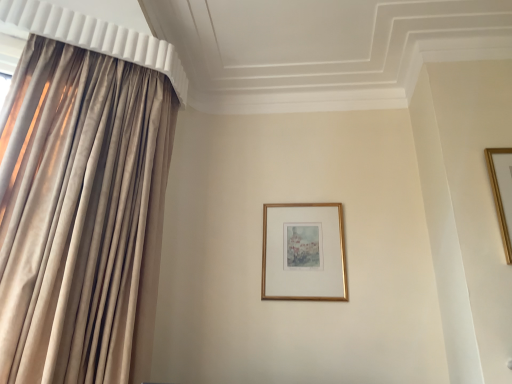
What do you see at coordinates (303, 252) in the screenshot? I see `gold metallic picture frame at center` at bounding box center [303, 252].

I want to click on gold metallic picture frame at center, so click(303, 252).

What is the approximate height of gold metallic picture frame at center?

19.39 inches.

Image resolution: width=512 pixels, height=384 pixels. In order to click on gold metallic picture frame at center in this screenshot , I will do (303, 252).